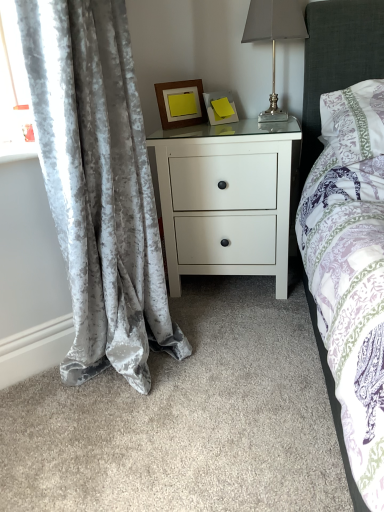
Image resolution: width=384 pixels, height=512 pixels. Identify the location of free spot in front of wooden frame at upper center, marked as the first picture frame in a left-to-right arrangement. (173, 131).